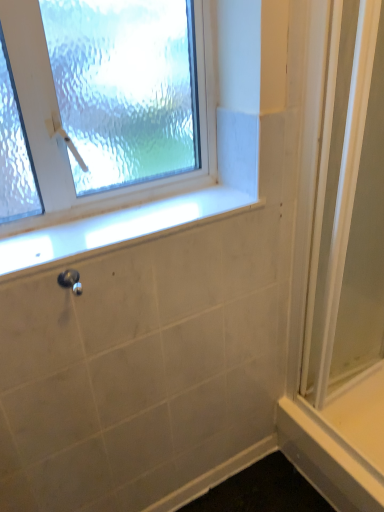
Question: Does point (210, 189) appear closer or farther from the camera than point (382, 229)?

Choices:
 (A) farther
 (B) closer

Answer: (B)

Question: Is white marble window sill at center wider or thinner than clear glass screen door at right?

Choices:
 (A) wide
 (B) thin

Answer: (A)

Question: Which of these objects is positioned closest to the white smooth ledge at lower right?

Choices:
 (A) clear glass screen door at right
 (B) satin nickel shower at lower left
 (C) white marble window sill at center
 (D) clear glass window at upper left

Answer: (A)

Question: Which object is the farthest from the clear glass screen door at right?

Choices:
 (A) clear glass window at upper left
 (B) white marble window sill at center
 (C) white smooth ledge at lower right
 (D) satin nickel shower at lower left

Answer: (D)